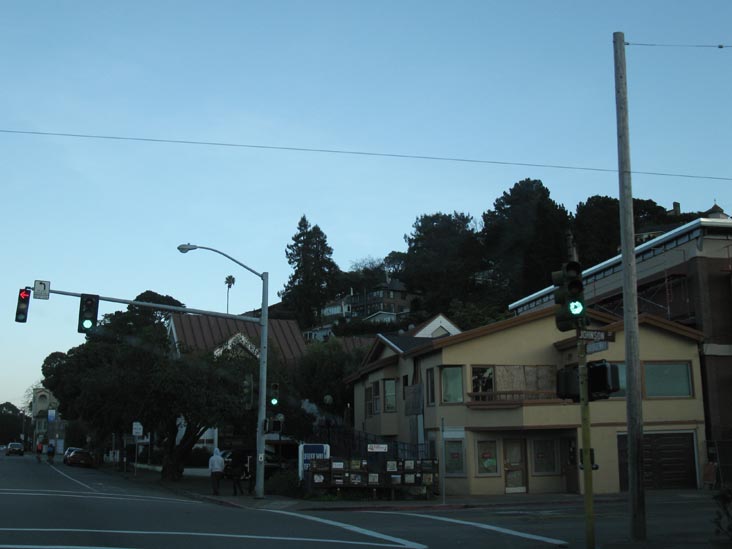
Where is `door`? This screenshot has width=732, height=549. door is located at coordinates coord(517,468).